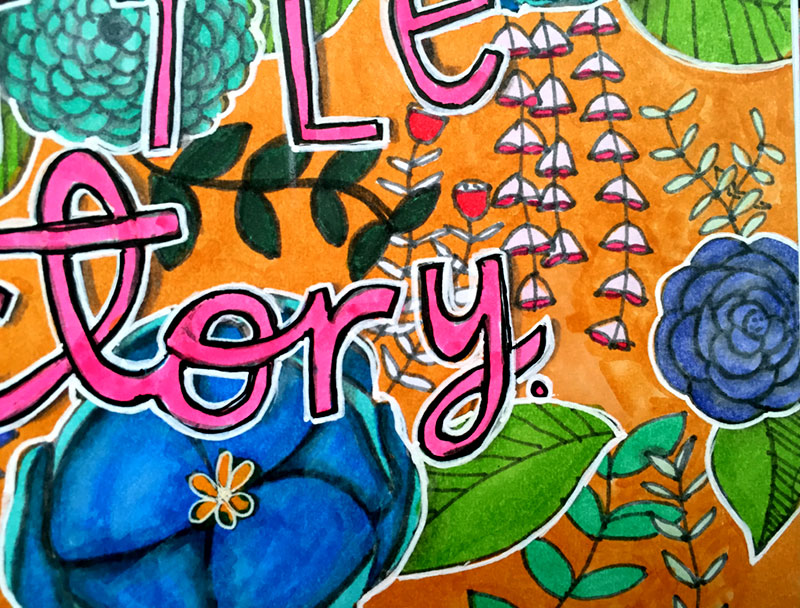
The image size is (800, 608). Find the location of `smaller leaf light green plant`. smaller leaf light green plant is located at coordinates tap(668, 529).